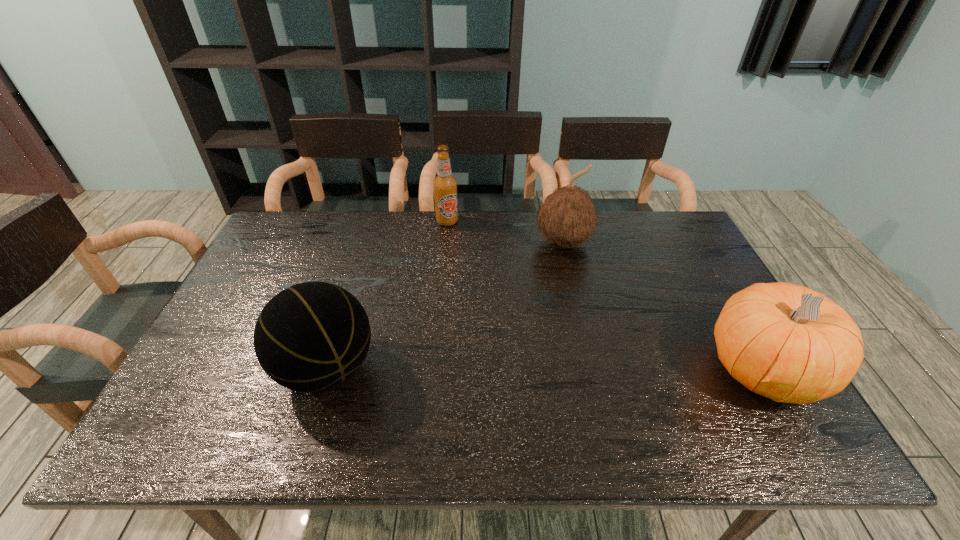
In the image, there is a desktop. At what (x,y) coordinates should I click in order to perform the action: click on vacant space at the far left corner. Please return your answer as a coordinate pair (x, y). The image size is (960, 540). Looking at the image, I should click on (320, 225).

This screenshot has height=540, width=960. What are the coordinates of `vacant space at the near right corner of the desktop` in the screenshot? It's located at (707, 377).

The height and width of the screenshot is (540, 960). Identify the location of free point between the second object from right to left and the leftmost object. (445, 306).

This screenshot has width=960, height=540. In order to click on vacant area between the second object from left to right and the second object from right to left in this screenshot , I will do `click(505, 232)`.

Find the location of a particular element. This screenshot has width=960, height=540. free space between the third object from left to right and the basketball is located at coordinates (445, 306).

The width and height of the screenshot is (960, 540). In order to click on vacant space that is in between the rightmost object and the second object from left to right in this screenshot , I will do `click(605, 296)`.

This screenshot has height=540, width=960. In order to click on free space between the pumpkin and the coconut in this screenshot , I will do `click(663, 306)`.

Where is `free spot between the basketball and the third object from right to left`? The width and height of the screenshot is (960, 540). free spot between the basketball and the third object from right to left is located at coordinates (387, 295).

Identify the location of free spot between the third object from right to left and the basketball. This screenshot has width=960, height=540. (387, 295).

At what (x,y) coordinates should I click in order to perform the action: click on free spot between the pumpkin and the second object from right to left. Please return your answer as a coordinate pair (x, y). Looking at the image, I should click on (663, 306).